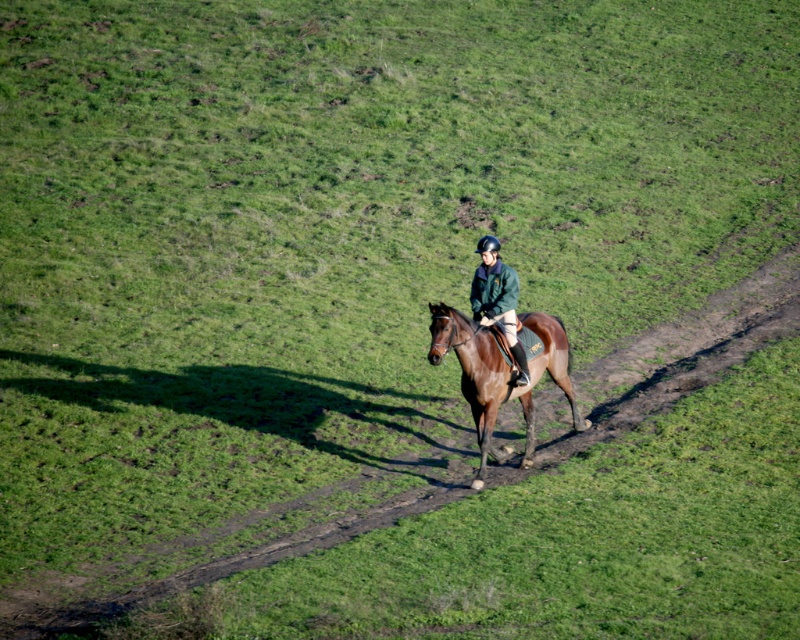
Can you confirm if brown glossy horse at center is wider than green matte jacket at center?

Indeed, brown glossy horse at center has a greater width compared to green matte jacket at center.

Who is lower down, brown glossy horse at center or green matte jacket at center?

brown glossy horse at center is below.

Image resolution: width=800 pixels, height=640 pixels. What do you see at coordinates (500, 372) in the screenshot?
I see `brown glossy horse at center` at bounding box center [500, 372].

The height and width of the screenshot is (640, 800). Find the location of `brown glossy horse at center`. brown glossy horse at center is located at coordinates tap(500, 372).